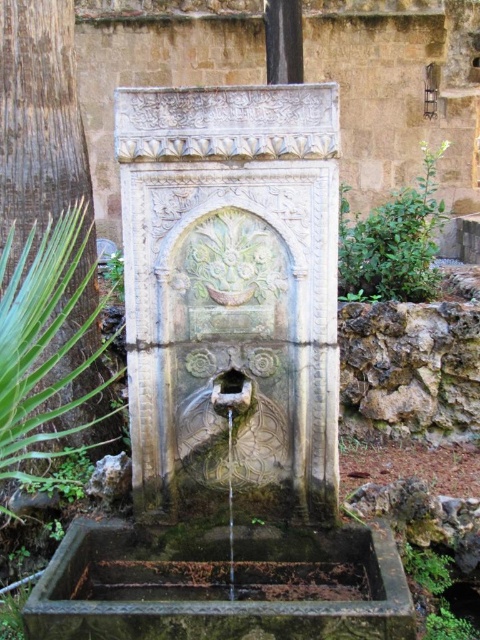
You are a landscape architect designing a garden path that needs to pass between the carved stone fountain at center and the clear glass water at center. The path must be at least 1 meter wide to accommodate visitors. Can the path fit between them based on their sizes?

The carved stone fountain at center is wider than the clear glass water at center. However, since both objects are at the center, they might be positioned closely together. Without specific distance information between them, it is unclear if the 1 meter path can fit. The question cannot be definitively answered with the provided details.

Consider the image. You are a visitor standing in front of the fountain and want to fill a small bottle with water from the fountain. Which object should you approach first, the carved stone fountain at center or the clear glass water at center?

You should approach the clear glass water at center first because the carved stone fountain at center is located above it, meaning the water is at a lower position and accessible for filling the bottle.

Based on the photo, you are standing in a garden and want to take a photo of the carved stone fountain at center. If your camera has a maximum focus range of 7 feet, will you be able to capture the fountain clearly?

The carved stone fountain at center is 7.13 feet away from the viewer. Since this distance exceeds the camera maximum focus range of 7 feet, the camera will not be able to capture the fountain clearly.